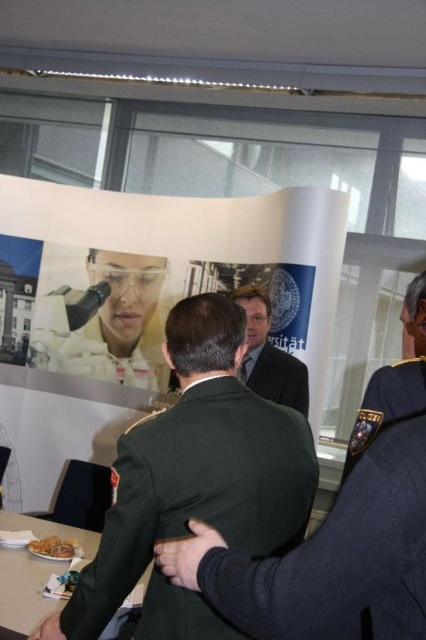
Question: Which point appears closest to the camera in this image?

Choices:
 (A) (414, 314)
 (B) (31, 604)

Answer: (A)

Question: Is green uniform at center positioned at the back of dark green fabric uniform at center?

Choices:
 (A) yes
 (B) no

Answer: (A)

Question: Which of the following is the farthest from the observer?

Choices:
 (A) (118, 499)
 (B) (402, 358)
 (C) (39, 547)
 (D) (276, 602)

Answer: (B)

Question: Which point is closer to the camera taking this photo?

Choices:
 (A) (305, 401)
 (B) (14, 525)
 (C) (60, 545)

Answer: (C)

Question: Is the position of dark blue uniform at right more distant than that of golden brown bread at lower left?

Choices:
 (A) no
 (B) yes

Answer: (A)

Question: Does dark green fabric uniform at center have a smaller size compared to green military uniform at center?

Choices:
 (A) yes
 (B) no

Answer: (A)